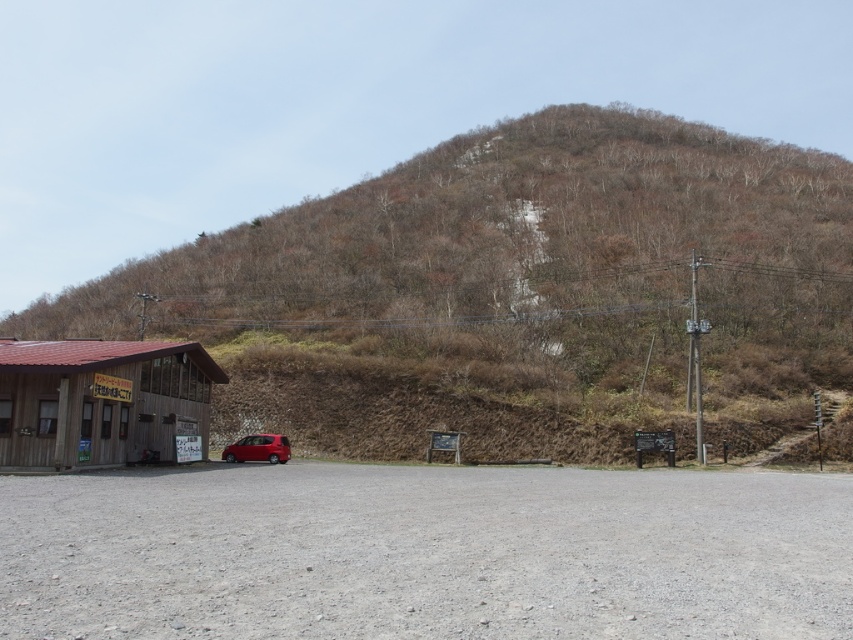
Which of these two, brown wooden building at lower left or brown wooden hut at lower left, stands taller?

brown wooden building at lower left is taller.

Between point (438, 202) and point (97, 445), which one is positioned in front?

Point (97, 445) is in front.

The image size is (853, 640). Find the location of `brown wooden building at lower left`. brown wooden building at lower left is located at coordinates [x=515, y=292].

Is brown wooden hut at lower left positioned behind shiny red car at lower center?

That is False.

Does point (33, 435) come in front of point (274, 445)?

Yes, it is.

At what (x,y) coordinates should I click in order to perform the action: click on brown wooden hut at lower left. Please return your answer as a coordinate pair (x, y). Looking at the image, I should click on (102, 403).

Does brown wooden building at lower left have a greater width compared to shiny red car at lower center?

Yes, brown wooden building at lower left is wider than shiny red car at lower center.

Who is positioned more to the right, brown wooden building at lower left or shiny red car at lower center?

brown wooden building at lower left is more to the right.

Is point (558, 388) farther from camera compared to point (265, 445)?

Yes, it is behind point (265, 445).

At what (x,y) coordinates should I click in order to perform the action: click on brown wooden building at lower left. Please return your answer as a coordinate pair (x, y). The height and width of the screenshot is (640, 853). Looking at the image, I should click on (515, 292).